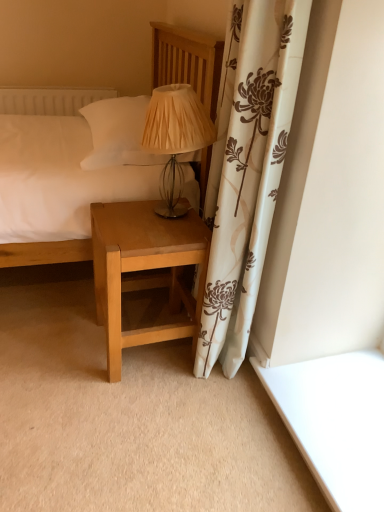
The height and width of the screenshot is (512, 384). I want to click on blank area to the left of matte beige fabric lampshade at center, so click(118, 213).